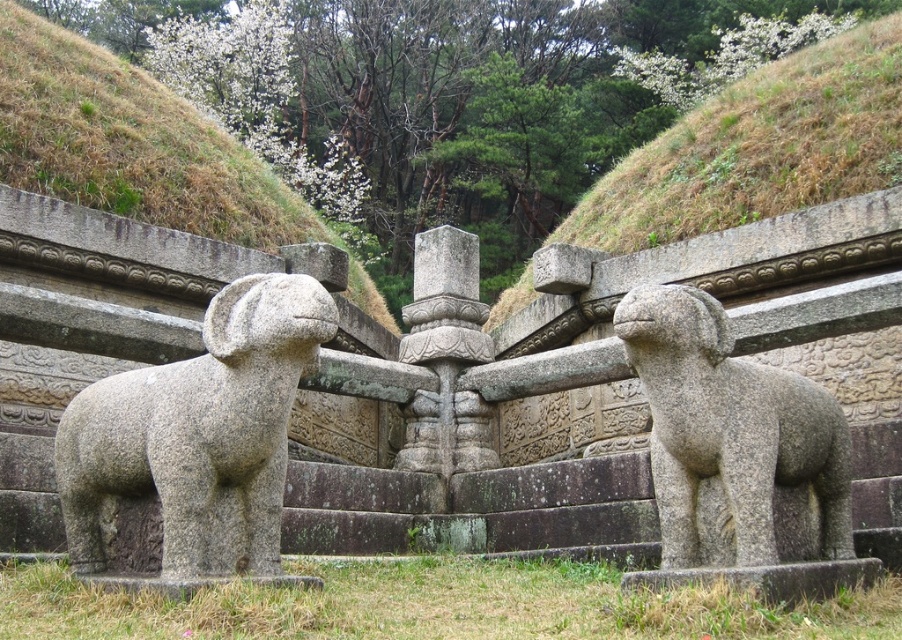
What do you see at coordinates (194, 442) in the screenshot? Image resolution: width=902 pixels, height=640 pixels. I see `gray stone dog at left` at bounding box center [194, 442].

Who is positioned more to the right, gray stone dog at left or green grassy hillside at upper center?

From the viewer's perspective, green grassy hillside at upper center appears more on the right side.

Which is in front, point (258, 460) or point (711, 182)?

Positioned in front is point (258, 460).

Identify the location of gray stone dog at left. (194, 442).

Does green grassy hillside at upper center have a lesser height compared to gray stone dog at right?

Incorrect, green grassy hillside at upper center's height does not fall short of gray stone dog at right's.

Which is more to the left, green grassy hillside at upper center or gray stone dog at right?

From the viewer's perspective, gray stone dog at right appears more on the left side.

Find the location of a particular element. The image size is (902, 640). green grassy hillside at upper center is located at coordinates (757, 147).

The height and width of the screenshot is (640, 902). What are the coordinates of `green grassy hillside at upper center` in the screenshot? It's located at (757, 147).

Looking at this image, which is above, gray stone dog at left or gray stone dog at right?

gray stone dog at right

Can you confirm if gray stone dog at left is positioned above gray stone dog at right?

Actually, gray stone dog at left is below gray stone dog at right.

I want to click on gray stone dog at left, so click(x=194, y=442).

Locate an element on the screen. The height and width of the screenshot is (640, 902). gray stone dog at left is located at coordinates (194, 442).